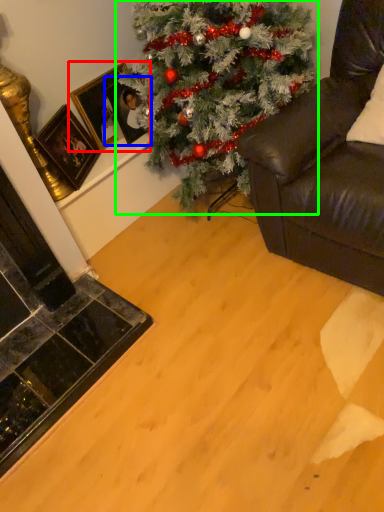
Question: Which object is positioned closest to picture frame (highlighted by a red box)? Select from picture frame (highlighted by a blue box) and christmas tree (highlighted by a green box).

Choices:
 (A) picture frame
 (B) christmas tree

Answer: (A)